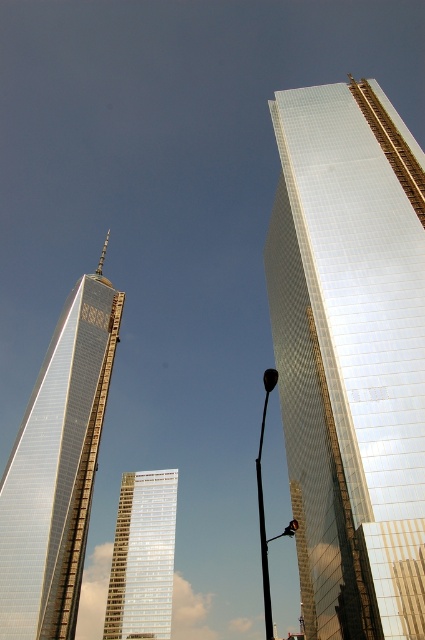
Question: Which of these objects is positioned farthest from the shiny glass skyscraper at left?

Choices:
 (A) shiny glass skyscraper at right
 (B) silver reflective glass building at center

Answer: (B)

Question: Which of the following is the closest to the observer?

Choices:
 (A) shiny glass skyscraper at left
 (B) silver reflective glass building at center

Answer: (A)

Question: Does shiny glass skyscraper at right lie in front of shiny glass skyscraper at left?

Choices:
 (A) no
 (B) yes

Answer: (B)

Question: Does shiny glass skyscraper at right appear over silver reflective glass building at center?

Choices:
 (A) no
 (B) yes

Answer: (B)

Question: Does shiny glass skyscraper at right appear on the right side of shiny glass skyscraper at left?

Choices:
 (A) no
 (B) yes

Answer: (B)

Question: Which object is farther from the camera taking this photo?

Choices:
 (A) silver reflective glass building at center
 (B) shiny glass skyscraper at left

Answer: (A)